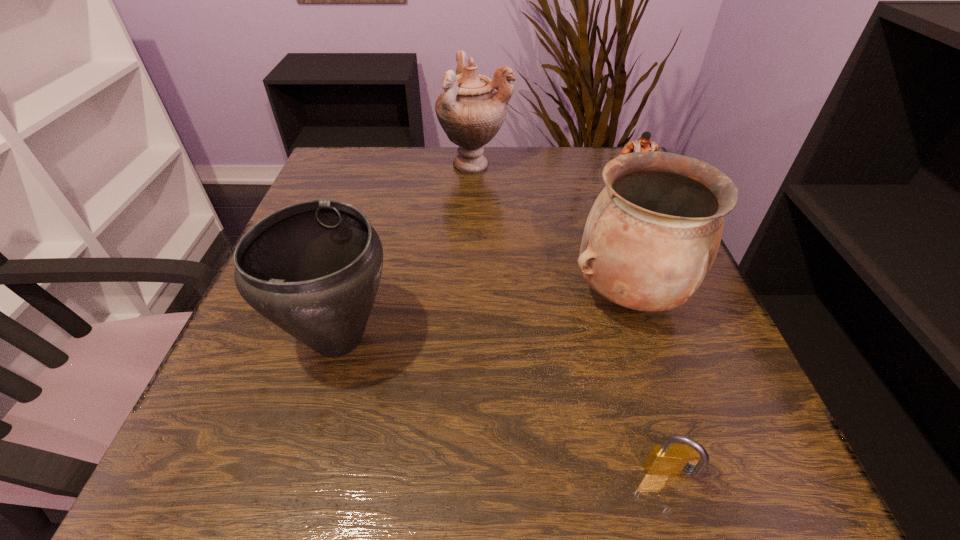
The width and height of the screenshot is (960, 540). I want to click on the second urn from right to left, so click(x=470, y=111).

The width and height of the screenshot is (960, 540). Identify the location of the farthest urn. (470, 111).

The height and width of the screenshot is (540, 960). I want to click on the rightmost urn, so click(651, 237).

Identify the location of the leftmost urn. (313, 268).

At what (x,y) coordinates should I click in order to perform the action: click on puncher. Please return your answer as a coordinate pair (x, y). Looking at the image, I should click on (643, 143).

Locate an element on the screen. the fourth nearest object is located at coordinates (643, 143).

This screenshot has width=960, height=540. What are the coordinates of `the nearest object` in the screenshot? It's located at (668, 459).

Identify the location of padlock. This screenshot has height=540, width=960. (668, 459).

Identify the location of free space located 0.060m on the front of the farthest urn. This screenshot has width=960, height=540. (474, 197).

Locate an element on the screen. vacant space situated on the left of the rightmost urn is located at coordinates (431, 295).